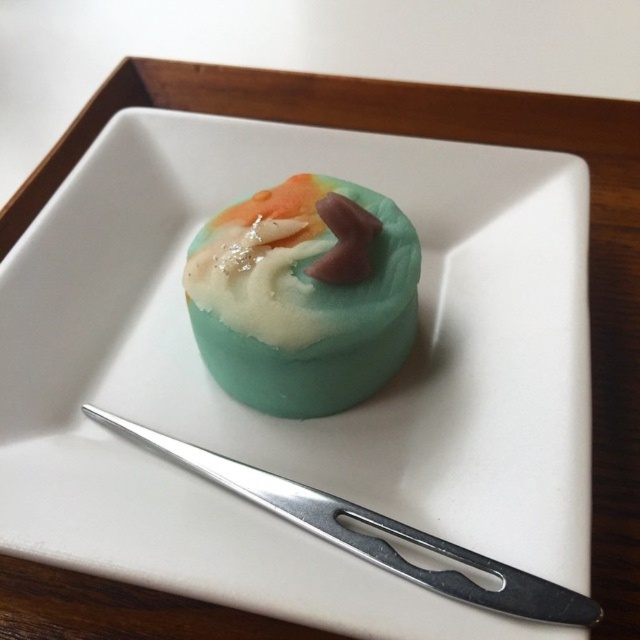
You are standing 5 feet away from the dessert. You want to reach the point at coordinates point (314, 381) on the dessert. Can you reach it without moving closer?

The distance of point (314, 381) from viewer is 4.02 feet, so yes, you can reach it without moving closer since you are standing 5 feet away which is farther than the point.

From the picture: What object is located at the coordinates point (305, 296) in the image?

The point (305, 296) corresponds to the matte teal cake at center.